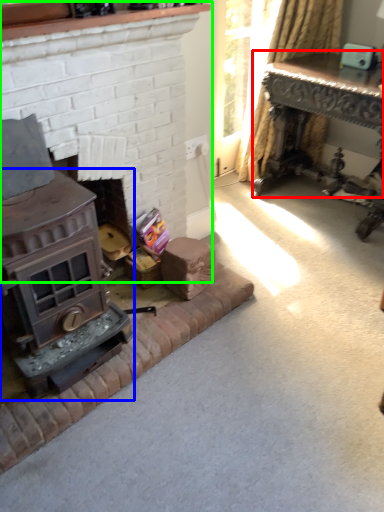
Question: Which is farther away from table (highlighted by a red box)? wood burning stove (highlighted by a blue box) or fireplace (highlighted by a green box)?

Choices:
 (A) wood burning stove
 (B) fireplace

Answer: (A)